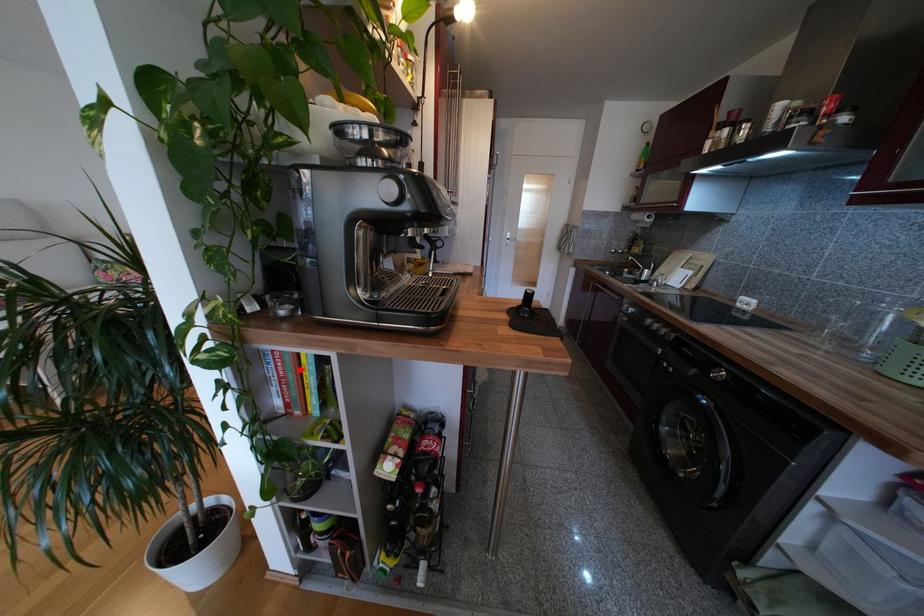
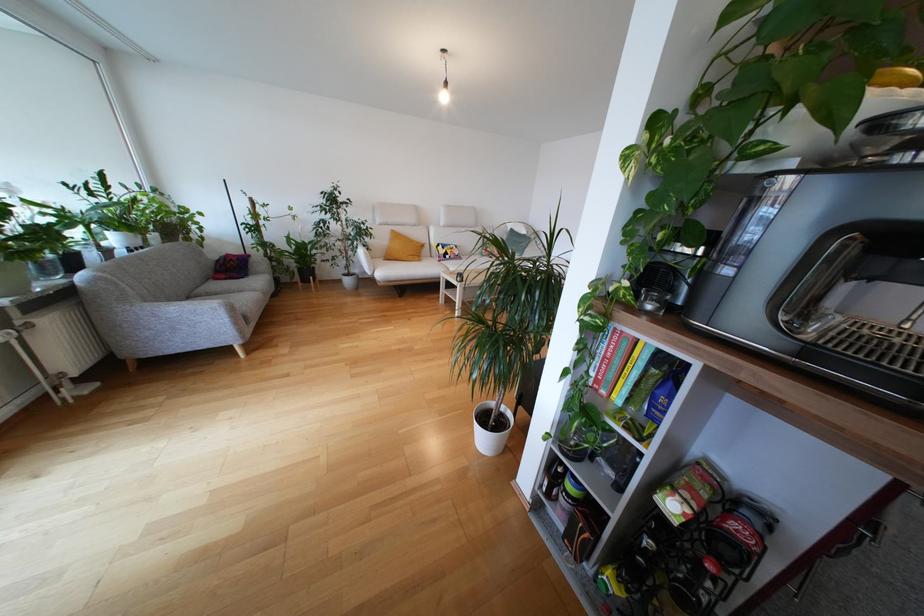
Find the pixel in the second image that matches the highlighted location in the first image.

(630, 358)